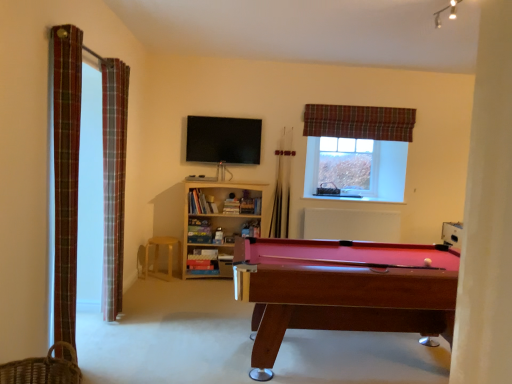
Image resolution: width=512 pixels, height=384 pixels. Describe the element at coordinates (223, 140) in the screenshot. I see `matte black pool table at center` at that location.

Image resolution: width=512 pixels, height=384 pixels. Describe the element at coordinates (114, 180) in the screenshot. I see `plaid fabric curtain at left, the second curtain from the back` at that location.

Describe the element at coordinates (217, 223) in the screenshot. I see `light wood/bookshelf at center` at that location.

The height and width of the screenshot is (384, 512). In order to click on plaid fabric curtain at left, which is the 2th curtain in right-to-left order in this screenshot , I will do `click(66, 174)`.

In terms of height, does plaid fabric curtain at left, the 2th curtain from the front, look taller or shorter compared to woven brown basket at lower left?

Considering their sizes, plaid fabric curtain at left, the 2th curtain from the front, has more height than woven brown basket at lower left.

Is woven brown basket at lower left completely or partially inside plaid fabric curtain at left, the second curtain from the back?

No, woven brown basket at lower left is not inside plaid fabric curtain at left, the second curtain from the back.

Between plaid fabric curtain at left, arranged as the 3th curtain when viewed from the right, and woven brown basket at lower left, which one has smaller width?

plaid fabric curtain at left, arranged as the 3th curtain when viewed from the right, is thinner.

Who is bigger, plaid fabric curtain at left, acting as the 1th curtain starting from the left, or woven brown basket at lower left?

Bigger between the two is plaid fabric curtain at left, acting as the 1th curtain starting from the left.

In terms of width, does matte black pool table at center look wider or thinner when compared to white matte radiator at center?

In the image, matte black pool table at center appears to be more narrow than white matte radiator at center.

Does matte black pool table at center come in front of white matte radiator at center?

Yes, it is.

Is matte black pool table at center turned away from white matte radiator at center?

That's not correct — matte black pool table at center is not looking away from white matte radiator at center.

Considering the sizes of objects matte black pool table at center and white matte radiator at center in the image provided, who is smaller, matte black pool table at center or white matte radiator at center?

Smaller between the two is matte black pool table at center.

Is point (118, 238) farther from camera compared to point (182, 272)?

No, it is not.

From the picture: Considering the positions of objects plaid fabric curtain at left, acting as the 1th curtain starting from the left, and light wood/bookshelf at center in the image provided, who is more to the left, plaid fabric curtain at left, acting as the 1th curtain starting from the left, or light wood/bookshelf at center?

Positioned to the left is plaid fabric curtain at left, acting as the 1th curtain starting from the left.

Based on the photo, between plaid fabric curtain at left, arranged as the 3th curtain when viewed from the right, and light wood/bookshelf at center, which one has larger size?

light wood/bookshelf at center is bigger.

Can you confirm if light wood stool at center is thinner than plaid fabric curtain at left, acting as the 1th curtain starting from the left?

No.

What's the angular difference between light wood stool at center and plaid fabric curtain at left, arranged as the 3th curtain when viewed from the right,'s facing directions?

86 degrees.

Is point (177, 242) less distant than point (105, 287)?

No.

In the scene shown: From a real-world perspective, between light wood stool at center and plaid fabric curtain at left, the second curtain from the back, who is vertically higher?

plaid fabric curtain at left, the second curtain from the back.

Would you say matte black pool table at center is a long distance from plaid fabric curtain at left, which is the 2th curtain in right-to-left order?

matte black pool table at center is positioned a significant distance from plaid fabric curtain at left, which is the 2th curtain in right-to-left order.

From the image's perspective, which one is positioned higher, matte black pool table at center or plaid fabric curtain at left, which is the 2th curtain in right-to-left order?

matte black pool table at center is shown above in the image.

Which of these two, matte black pool table at center or plaid fabric curtain at left, which appears as the third curtain when viewed from the back, stands shorter?

Standing shorter between the two is matte black pool table at center.

How many degrees apart are the facing directions of matte black pool table at center and plaid fabric curtain at left, which ranks as the 1th curtain in front-to-back order?

matte black pool table at center and plaid fabric curtain at left, which ranks as the 1th curtain in front-to-back order, are facing 87.7 degrees away from each other.

Could you measure the distance between white matte radiator at center and plaid fabric curtain at left, arranged as the 3th curtain when viewed from the right?

A distance of 3.24 meters exists between white matte radiator at center and plaid fabric curtain at left, arranged as the 3th curtain when viewed from the right.

Considering the positions of objects white matte radiator at center and plaid fabric curtain at left, the second curtain from the back, in the image provided, who is more to the left, white matte radiator at center or plaid fabric curtain at left, the second curtain from the back,?

plaid fabric curtain at left, the second curtain from the back, is more to the left.

Between white matte radiator at center and plaid fabric curtain at left, the second curtain from the back, which one has smaller width?

Thinner between the two is white matte radiator at center.

Could you tell me if white matte radiator at center is facing plaid fabric curtain at left, arranged as the 3th curtain when viewed from the right?

No, white matte radiator at center is not turned towards plaid fabric curtain at left, arranged as the 3th curtain when viewed from the right.

From the image's perspective, between light wood stool at center and rubberized wood pool table at lower right, which one is located above?

light wood stool at center, from the image's perspective.

Can you confirm if light wood stool at center is bigger than rubberized wood pool table at lower right?

Incorrect, light wood stool at center is not larger than rubberized wood pool table at lower right.

Is light wood stool at center completely or partially outside of rubberized wood pool table at lower right?

Indeed, light wood stool at center is completely outside rubberized wood pool table at lower right.

How different are the orientations of light wood stool at center and rubberized wood pool table at lower right in degrees?

2.1 degrees.

Where is `basket in front of the plaid fabric curtain at left, arranged as the 3th curtain when viewed from the right`? Image resolution: width=512 pixels, height=384 pixels. basket in front of the plaid fabric curtain at left, arranged as the 3th curtain when viewed from the right is located at coordinates (42, 369).

This screenshot has height=384, width=512. What are the coordinates of `billard positioned vertically above the white matte radiator at center (from a real-world perspective)` in the screenshot? It's located at (223, 140).

Which object lies further to the anchor point light wood stool at center, light wood/bookshelf at center or matte black pool table at center?

Based on the image, matte black pool table at center appears to be further to light wood stool at center.

Considering their positions, is clear plastic window screen at upper right positioned further to matte black pool table at center than plaid fabric curtain at left, acting as the 1th curtain starting from the left?

Based on the image, plaid fabric curtain at left, acting as the 1th curtain starting from the left, appears to be further to matte black pool table at center.

When comparing their distances from clear plastic window screen at upper right, does plaid fabric curtain at left, acting as the 1th curtain starting from the left, or rubberized wood pool table at lower right seem further?

Among the two, plaid fabric curtain at left, acting as the 1th curtain starting from the left, is located further to clear plastic window screen at upper right.

Looking at this image, when comparing their distances from light wood stool at center, does plaid fabric curtain at upper right, the first curtain positioned from the right, or plaid fabric curtain at left, which is the 2th curtain in right-to-left order, seem closer?

Based on the image, plaid fabric curtain at left, which is the 2th curtain in right-to-left order, appears to be nearer to light wood stool at center.

From the image, which object appears to be farther from light wood stool at center, light wood/bookshelf at center or clear plastic window screen at upper right?

clear plastic window screen at upper right lies further to light wood stool at center than the other object.

From the image, which object appears to be nearer to white matte radiator at center, clear plastic window screen at upper right or plaid fabric curtain at left, the second curtain from the back?

The object closer to white matte radiator at center is clear plastic window screen at upper right.

In the scene shown: Considering their positions, is matte black pool table at center positioned closer to woven brown basket at lower left than light wood stool at center?

Based on the image, light wood stool at center appears to be nearer to woven brown basket at lower left.

When comparing their distances from clear plastic window screen at upper right, does light wood/bookshelf at center or woven brown basket at lower left seem further?

Based on the image, woven brown basket at lower left appears to be further to clear plastic window screen at upper right.

The image size is (512, 384). Identify the location of billard between light wood stool at center and plaid fabric curtain at upper right, arranged as the 1th curtain when viewed from the back, from left to right. (223, 140).

The image size is (512, 384). Identify the location of billard situated between plaid fabric curtain at left, acting as the 1th curtain starting from the left, and plaid fabric curtain at upper right, which is counted as the third curtain, starting from the left, from left to right. (223, 140).

The height and width of the screenshot is (384, 512). Find the location of `shelf between plaid fabric curtain at left, the second curtain from the back, and white matte radiator at center`. shelf between plaid fabric curtain at left, the second curtain from the back, and white matte radiator at center is located at coordinates (217, 223).

You are a GUI agent. You are given a task and a screenshot of the screen. Output one action in this format:
    pyautogui.click(x=<x>, y=<y>)
    Task: Click on the stool between rubberized wood pool table at lower right and light wood/bookshelf at center in the front-back direction
    Image resolution: width=512 pixels, height=384 pixels.
    Given the screenshot: What is the action you would take?
    pyautogui.click(x=158, y=256)